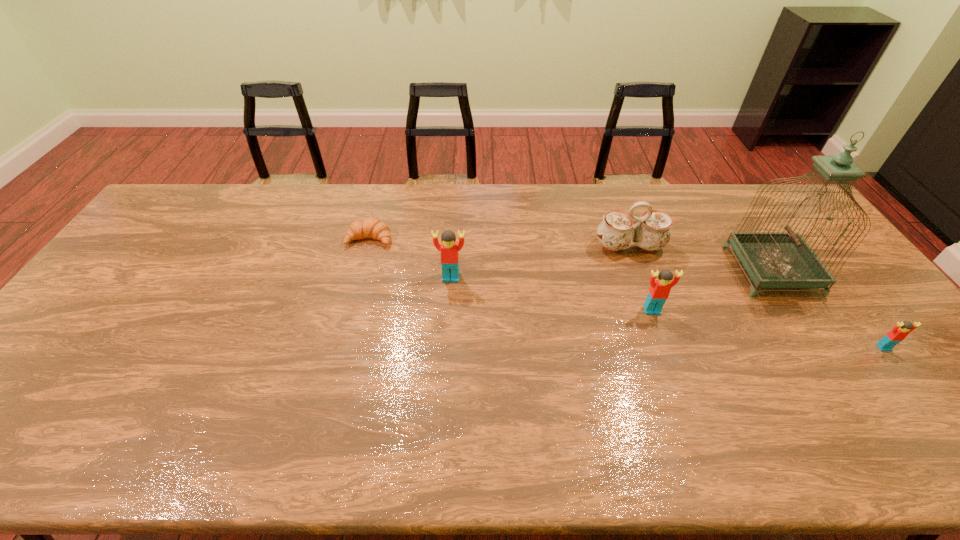
Where is `birdcage that is at the right edge`? birdcage that is at the right edge is located at coordinates (773, 259).

I want to click on vacant area at the far edge, so click(x=612, y=195).

You are a GUI agent. You are given a task and a screenshot of the screen. Output one action in this format:
    pyautogui.click(x=<x>, y=<y>)
    Task: Click on the free point at the near edge
    This screenshot has height=540, width=960.
    Given the screenshot: What is the action you would take?
    pyautogui.click(x=571, y=413)

The width and height of the screenshot is (960, 540). Identify the location of blank space at the left edge. (74, 333).

Find the location of a particular element. This screenshot has width=960, height=540. free region at the right edge is located at coordinates (812, 244).

Locate an element on the screen. This screenshot has width=960, height=540. vacant space at the far left corner of the desktop is located at coordinates (190, 211).

Find the location of a particular element. The height and width of the screenshot is (540, 960). free space between the farthest Lego and the second Lego from right to left is located at coordinates (551, 294).

Find the location of a particular element. This screenshot has width=960, height=540. empty space that is in between the chinaware and the tallest object is located at coordinates (701, 258).

Identify the location of free space between the crescent roll and the second shortest Lego. [x=511, y=274].

This screenshot has width=960, height=540. Identify the location of free space between the second object from right to left and the shortest Lego. pos(828,309).